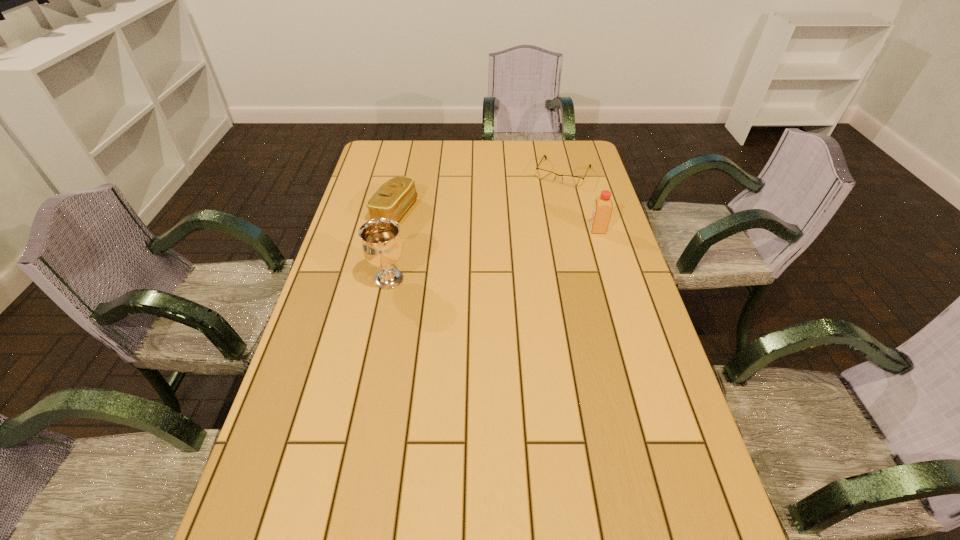
This screenshot has width=960, height=540. I want to click on vacant area in the image that satisfies the following two spatial constraints: 1. on the front side of the orange juice; 2. on the front and back of the clutch bag, so click(x=391, y=230).

The width and height of the screenshot is (960, 540). Find the location of `vacant region that satisfies the following two spatial constraints: 1. on the front side of the clutch bag; 2. on the front and back of the orange juice`. vacant region that satisfies the following two spatial constraints: 1. on the front side of the clutch bag; 2. on the front and back of the orange juice is located at coordinates (391, 230).

You are a GUI agent. You are given a task and a screenshot of the screen. Output one action in this format:
    pyautogui.click(x=<x>, y=<y>)
    Task: Click on the free location that satisfies the following two spatial constraints: 1. on the front side of the nearest object; 2. on the right side of the third tallest object
    The image size is (960, 540).
    Given the screenshot: What is the action you would take?
    pyautogui.click(x=379, y=279)

I want to click on blank space that satisfies the following two spatial constraints: 1. on the front side of the clutch bag; 2. on the front and back of the orange juice, so click(391, 230).